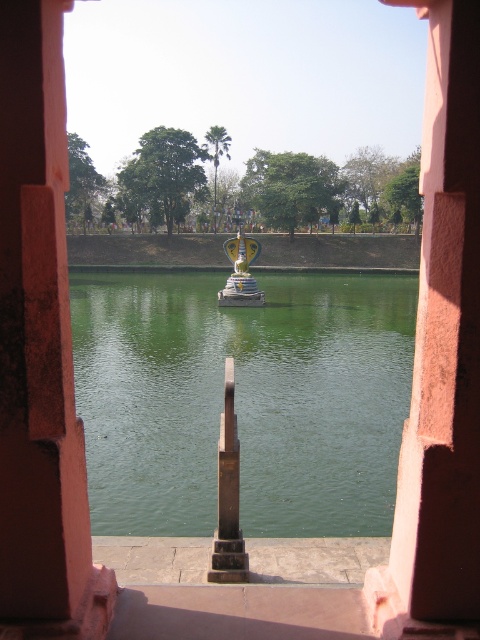
Question: Can you confirm if green smooth water at center is positioned below smooth pink stone pillar at center?

Choices:
 (A) no
 (B) yes

Answer: (A)

Question: Which point appears closest to the camera in this image?

Choices:
 (A) (381, 426)
 (B) (0, 22)

Answer: (B)

Question: Can you confirm if green smooth water at center is positioned to the left of smooth pink stone pillar at center?

Choices:
 (A) yes
 (B) no

Answer: (B)

Question: Among these objects, which one is nearest to the camera?

Choices:
 (A) smooth pink stone pillar at center
 (B) green smooth water at center

Answer: (A)

Question: Considering the relative positions of green smooth water at center and smooth pink stone pillar at center in the image provided, where is green smooth water at center located with respect to smooth pink stone pillar at center?

Choices:
 (A) below
 (B) above

Answer: (B)

Question: Among these objects, which one is nearest to the camera?

Choices:
 (A) smooth pink stone pillar at center
 (B) green smooth water at center

Answer: (A)